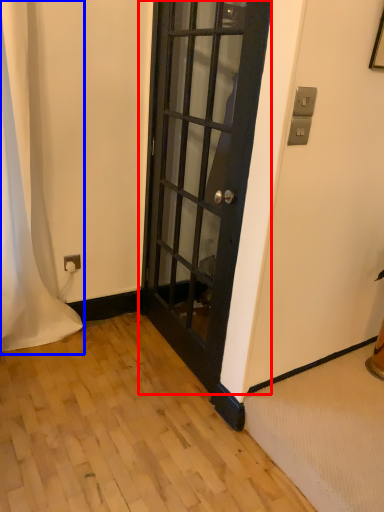
Question: Which of the following is the farthest to the observer, door (highlighted by a red box) or curtain (highlighted by a blue box)?

Choices:
 (A) door
 (B) curtain

Answer: (B)